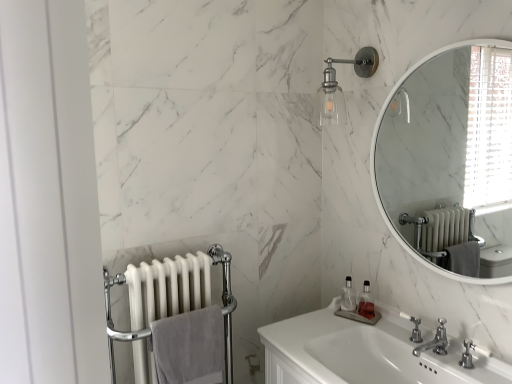
The image size is (512, 384). What are the coordinates of `vacant space that's between clear plastic soap dispenser at lower center, positioned as the 1th soap dispenser in left-to-right order, and white plastic faucet at lower right, the second plumbing fixture positioned from the front` in the screenshot? It's located at (377, 330).